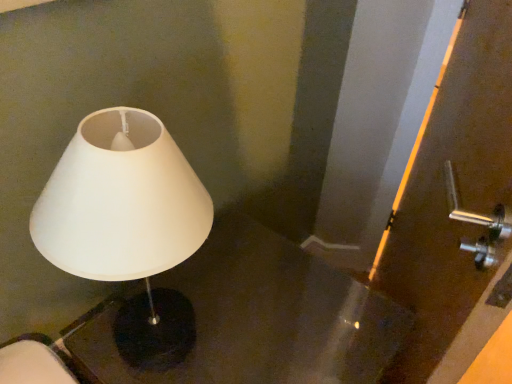
Question: Does white matte lampshade at left appear on the left side of black glossy table at left?

Choices:
 (A) yes
 (B) no

Answer: (A)

Question: Is white matte lampshade at left in contact with black glossy table at left?

Choices:
 (A) yes
 (B) no

Answer: (B)

Question: Is white matte lampshade at left outside of black glossy table at left?

Choices:
 (A) no
 (B) yes

Answer: (B)

Question: Does white matte lampshade at left have a greater width compared to black glossy table at left?

Choices:
 (A) yes
 (B) no

Answer: (B)

Question: Can you confirm if white matte lampshade at left is positioned to the right of black glossy table at left?

Choices:
 (A) yes
 (B) no

Answer: (B)

Question: From the image's perspective, is white matte lampshade at left above or below black glossy table at left?

Choices:
 (A) above
 (B) below

Answer: (A)

Question: From a real-world perspective, is white matte lampshade at left physically located above or below black glossy table at left?

Choices:
 (A) below
 (B) above

Answer: (B)

Question: Considering their positions, is white matte lampshade at left located in front of or behind black glossy table at left?

Choices:
 (A) front
 (B) behind

Answer: (A)

Question: Is white matte lampshade at left bigger or smaller than black glossy table at left?

Choices:
 (A) small
 (B) big

Answer: (A)

Question: Does point (500, 18) appear closer or farther from the camera than point (93, 342)?

Choices:
 (A) farther
 (B) closer

Answer: (B)

Question: From a real-world perspective, relative to black glossy table at left, is matte brown screen door at right vertically above or below?

Choices:
 (A) above
 (B) below

Answer: (A)

Question: Is matte brown screen door at right in front of or behind black glossy table at left in the image?

Choices:
 (A) behind
 (B) front

Answer: (B)

Question: In terms of height, does matte brown screen door at right look taller or shorter compared to black glossy table at left?

Choices:
 (A) tall
 (B) short

Answer: (A)

Question: Relative to white matte lampshade at left, is matte brown screen door at right in front or behind?

Choices:
 (A) front
 (B) behind

Answer: (B)

Question: In terms of size, does matte brown screen door at right appear bigger or smaller than white matte lampshade at left?

Choices:
 (A) small
 (B) big

Answer: (B)